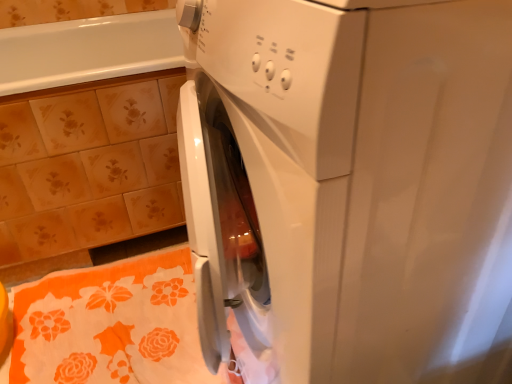
Question: Is white glossy washing machine at center positioned beyond the bounds of floral ceramic tile at upper left?

Choices:
 (A) yes
 (B) no

Answer: (A)

Question: Could you tell me if white glossy washing machine at center is facing floral ceramic tile at upper left?

Choices:
 (A) yes
 (B) no

Answer: (B)

Question: From a real-world perspective, does white glossy washing machine at center stand above floral ceramic tile at upper left?

Choices:
 (A) no
 (B) yes

Answer: (B)

Question: From a real-world perspective, is white glossy washing machine at center below floral ceramic tile at upper left?

Choices:
 (A) no
 (B) yes

Answer: (A)

Question: Considering the relative sizes of white glossy washing machine at center and floral ceramic tile at upper left in the image provided, is white glossy washing machine at center thinner than floral ceramic tile at upper left?

Choices:
 (A) yes
 (B) no

Answer: (A)

Question: Is white glossy washing machine at center situated inside floral ceramic tile at upper left or outside?

Choices:
 (A) inside
 (B) outside

Answer: (B)

Question: Is white glossy washing machine at center wider or thinner than floral ceramic tile at upper left?

Choices:
 (A) thin
 (B) wide

Answer: (A)

Question: Considering the positions of point (402, 107) and point (17, 254), is point (402, 107) closer or farther from the camera than point (17, 254)?

Choices:
 (A) closer
 (B) farther

Answer: (A)

Question: From the image's perspective, is white glossy washing machine at center located above or below floral ceramic tile at upper left?

Choices:
 (A) below
 (B) above

Answer: (A)

Question: Based on their positions, is orange floral bath towel at lower left located to the left or right of white glossy washing machine at center?

Choices:
 (A) left
 (B) right

Answer: (A)

Question: From a real-world perspective, relative to white glossy washing machine at center, is orange floral bath towel at lower left vertically above or below?

Choices:
 (A) above
 (B) below

Answer: (B)

Question: Is orange floral bath towel at lower left in front of or behind white glossy washing machine at center in the image?

Choices:
 (A) front
 (B) behind

Answer: (B)

Question: Is point (197, 355) closer or farther from the camera than point (479, 119)?

Choices:
 (A) closer
 (B) farther

Answer: (B)

Question: From the image's perspective, is floral ceramic tile at upper left located above or below orange floral bath towel at lower left?

Choices:
 (A) below
 (B) above

Answer: (B)

Question: Visually, is floral ceramic tile at upper left positioned to the left or to the right of orange floral bath towel at lower left?

Choices:
 (A) right
 (B) left

Answer: (B)